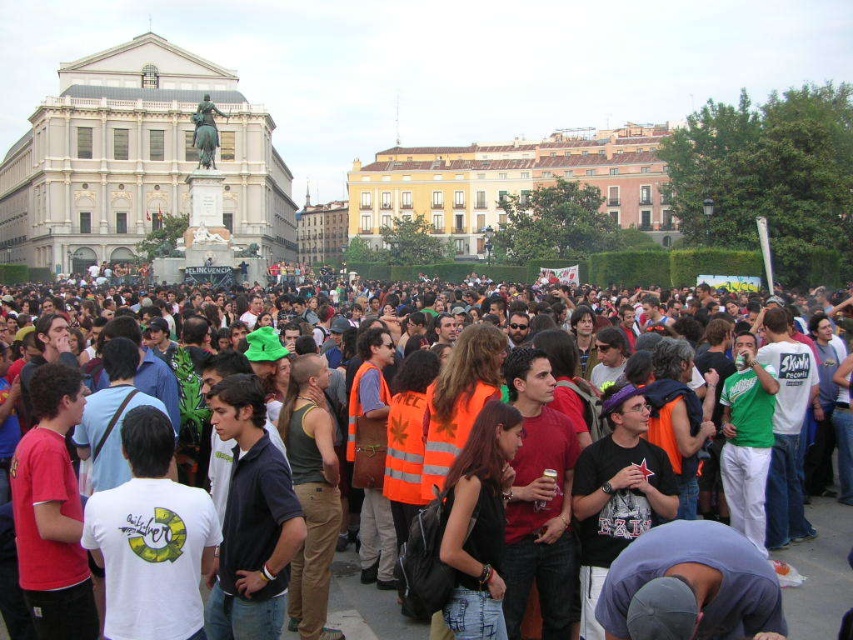
Who is higher up, yellow brick building at upper center or orange reflective vests at center?

Positioned higher is yellow brick building at upper center.

Can you confirm if yellow brick building at upper center is positioned to the left of orange reflective vests at center?

No, yellow brick building at upper center is not to the left of orange reflective vests at center.

Who is more distant from viewer, [587,148] or [799,637]?

Point [587,148]

The height and width of the screenshot is (640, 853). In order to click on yellow brick building at upper center in this screenshot , I will do `click(509, 182)`.

Between white marble palace at upper left and orange reflective vests at center, which one appears on the right side from the viewer's perspective?

orange reflective vests at center

Between white marble palace at upper left and orange reflective vests at center, which one is positioned higher?

white marble palace at upper left

Who is more forward, (183, 56) or (834, 538)?

Point (834, 538) is in front.

In order to click on white marble palace at upper left in this screenshot , I will do `click(137, 163)`.

Based on the photo, does white marble palace at upper left have a larger size compared to yellow brick building at upper center?

Yes, white marble palace at upper left is bigger than yellow brick building at upper center.

Is point (61, 218) in front of point (469, 145)?

Yes, point (61, 218) is closer to viewer.

This screenshot has width=853, height=640. I want to click on white marble palace at upper left, so click(137, 163).